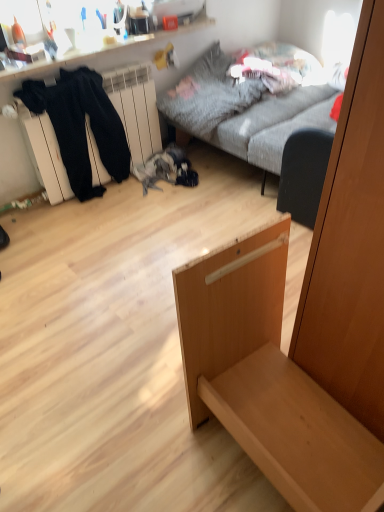
Where is `free space to the left of light wood drawer at center`? This screenshot has height=512, width=384. free space to the left of light wood drawer at center is located at coordinates (140, 432).